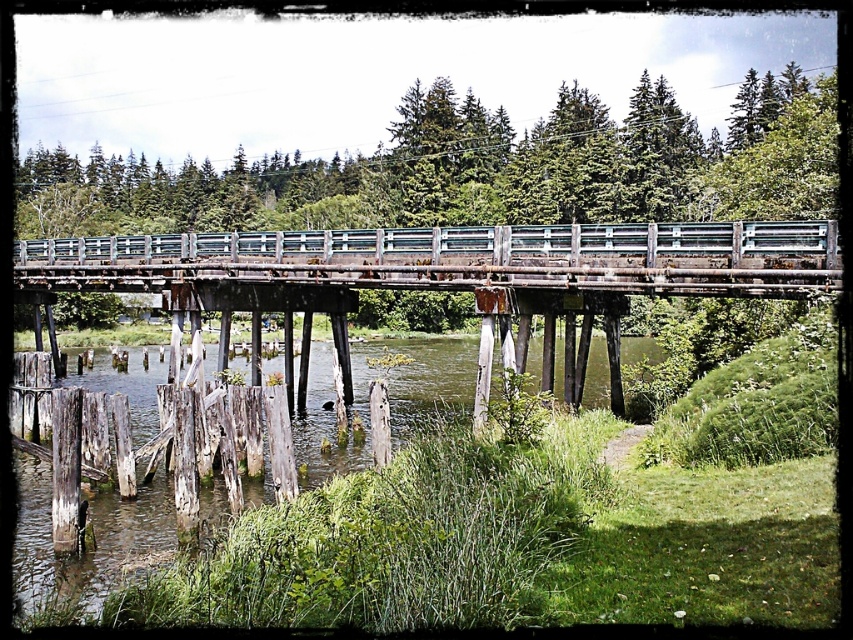
You are standing on the rustic wooden bridge and looking down at the water. There is a point marked at coordinates [453,259]. What object is located at that point?

The point at coordinates [453,259] corresponds to the rusty metal bridge at center.

You are a hiker carrying a 10 meter long log. You want to cross the river using the rusty metal bridge at center. Can you safely carry the log across the bridge without it touching the wooden posts at lower left?

The distance between the rusty metal bridge at center and the wooden posts at lower left is 11.03 meters. Since the log is 10 meters long, it can be carried safely without touching the posts as there is enough space between them.

You are a bird flying over the scene. You want to land on the highest point between the rusty metal bridge at center and the wooden posts at lower left. Which one should you choose?

The rusty metal bridge at center is taller than the wooden posts at lower left, so you should land on the rusty metal bridge at center.